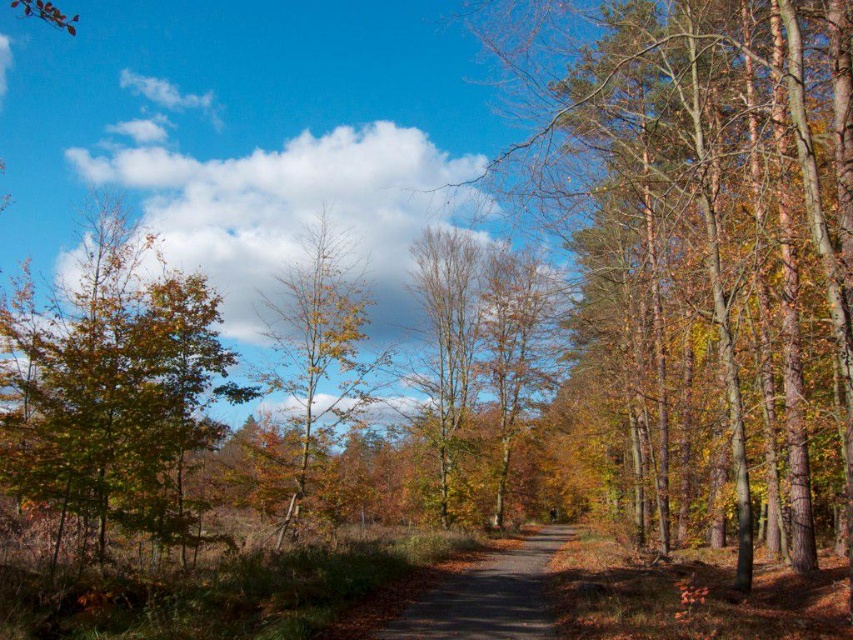
You are standing on the forest path and want to reach a point that is closer to you. Which point should you head towards, point [305,304] or point [433,378]?

You should head towards point [305,304] because it is closer to you than point [433,378] according to the description.

You are standing at the center of the forest path and see a point marked at coordinates [111,388]. What object does this point correspond to?

The point corresponds to the green matte tree at left.